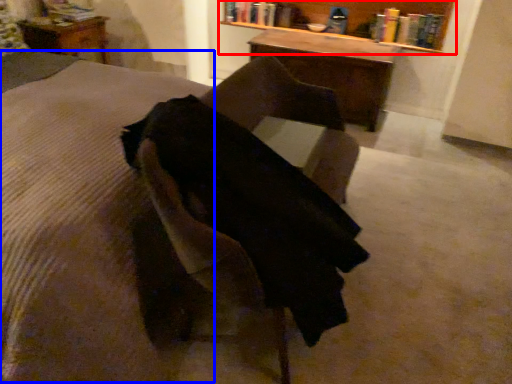
Question: Among these objects, which one is nearest to the camera, bookcase (highlighted by a red box) or mattress (highlighted by a blue box)?

Choices:
 (A) bookcase
 (B) mattress

Answer: (B)